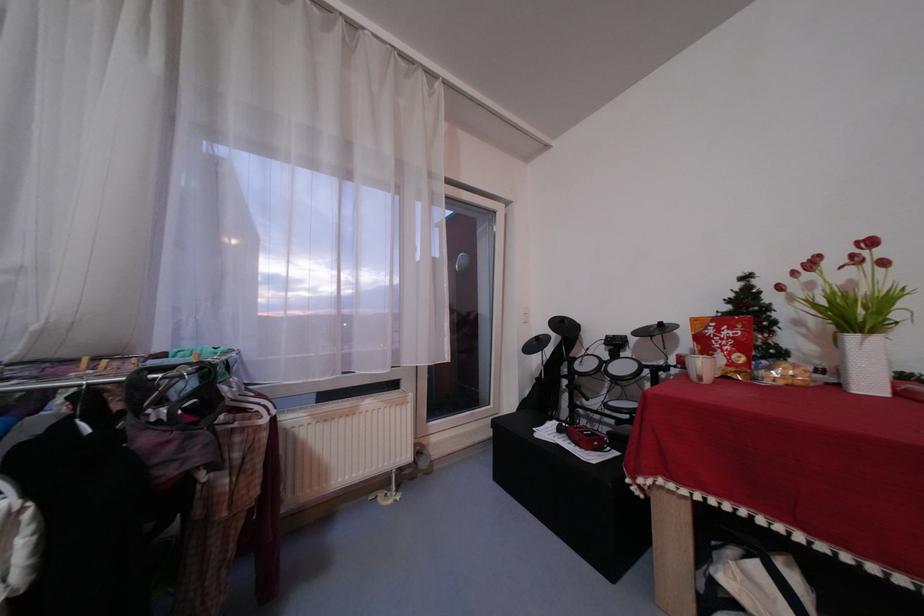
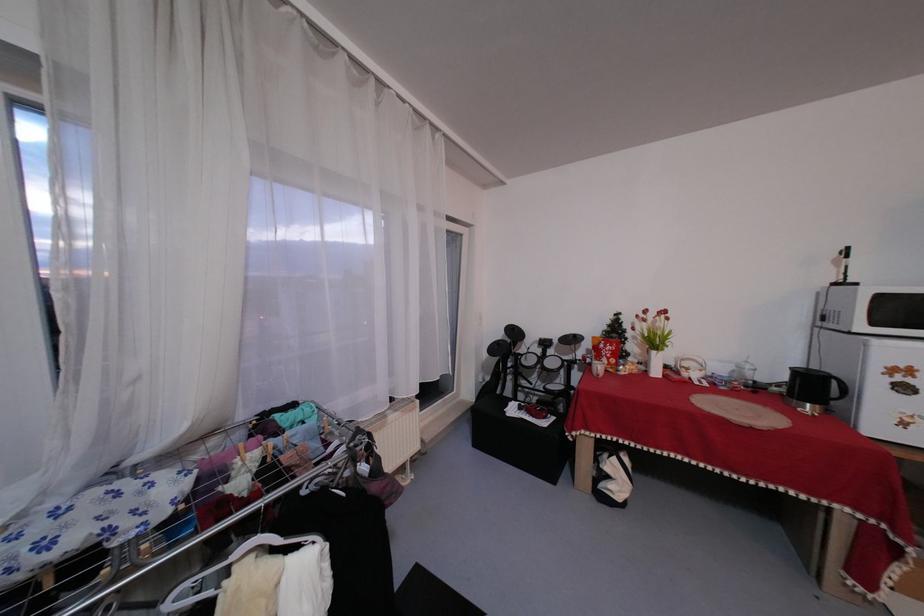
In a continuous first-person perspective shot, in which direction is the camera moving?

The cameraman moved toward left, backward.